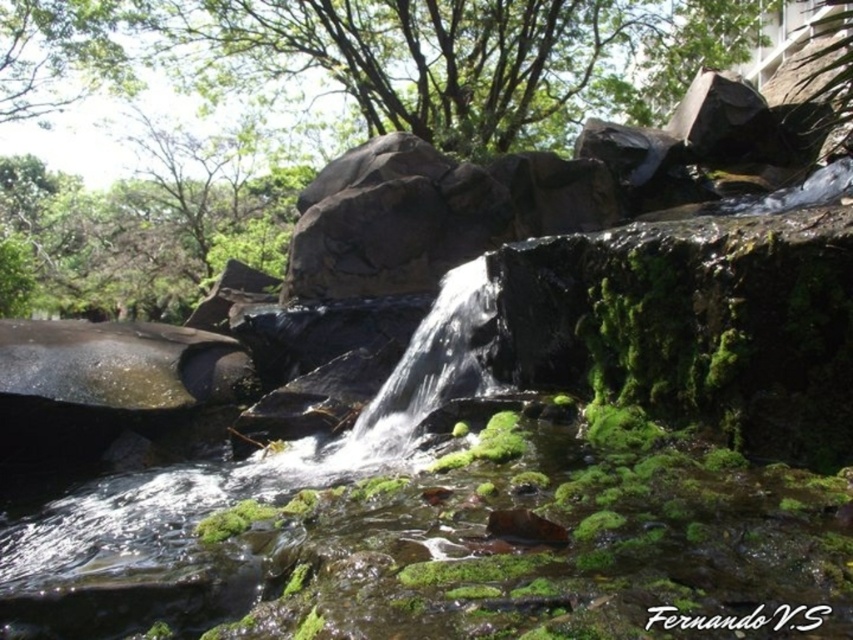
Question: Does green leafy tree at upper center come behind clear water at center?

Choices:
 (A) no
 (B) yes

Answer: (B)

Question: Which object appears farthest from the camera in this image?

Choices:
 (A) clear water at center
 (B) green leafy tree at upper center

Answer: (B)

Question: Does green leafy tree at upper center have a larger size compared to clear water at center?

Choices:
 (A) no
 (B) yes

Answer: (B)

Question: Is green leafy tree at upper center below clear water at center?

Choices:
 (A) no
 (B) yes

Answer: (A)

Question: Among these objects, which one is nearest to the camera?

Choices:
 (A) clear water at center
 (B) green leafy tree at upper center

Answer: (A)